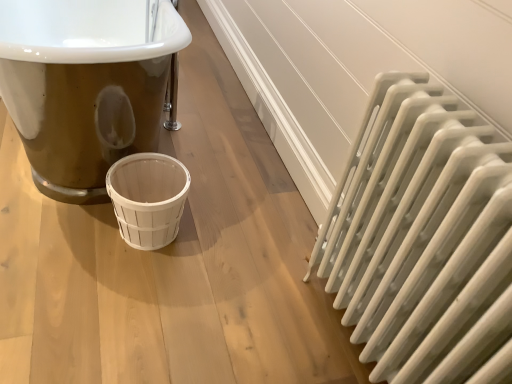
You are a GUI agent. You are given a task and a screenshot of the screen. Output one action in this format:
    pyautogui.click(x=<x>, y=<y>)
    Task: Click on the vacant region to the left of white wood basket at center
    Image resolution: width=512 pixels, height=384 pixels.
    Given the screenshot: What is the action you would take?
    pyautogui.click(x=71, y=226)